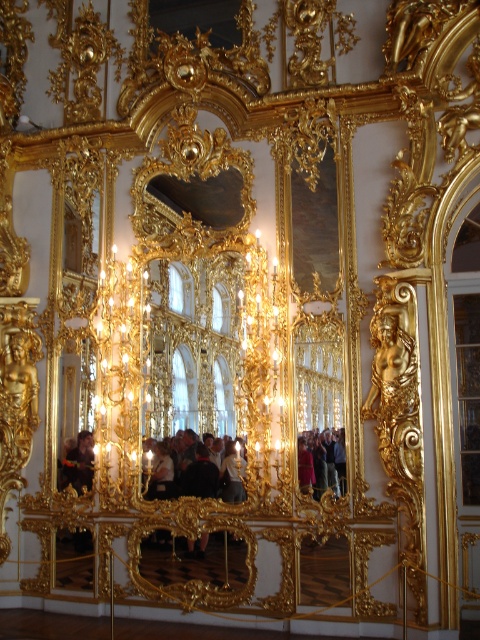
Between dark brown leather jacket at center and dark brown leather jacket at lower left, which one has more height?

With more height is dark brown leather jacket at lower left.

Can you confirm if dark brown leather jacket at center is thinner than dark brown leather jacket at lower left?

In fact, dark brown leather jacket at center might be wider than dark brown leather jacket at lower left.

Which is in front, point (237, 472) or point (88, 464)?

Point (237, 472) is more forward.

Locate an element on the screen. This screenshot has width=480, height=640. dark brown leather jacket at center is located at coordinates pos(206,476).

Can you confirm if shiny gold chandelier at center is positioned to the left of dark brown leather jacket at center?

Yes, shiny gold chandelier at center is to the left of dark brown leather jacket at center.

Who is positioned more to the left, shiny gold chandelier at center or dark brown leather jacket at center?

From the viewer's perspective, shiny gold chandelier at center appears more on the left side.

Between point (95, 339) and point (169, 493), which one is positioned behind?

Point (95, 339)

Locate an element on the screen. This screenshot has height=640, width=480. shiny gold chandelier at center is located at coordinates (120, 337).

Based on the photo, does dark brown leather jacket at center appear over matte black jacket at center?

No.

Consider the image. Is dark brown leather jacket at center to the left of matte black jacket at center from the viewer's perspective?

Indeed, dark brown leather jacket at center is positioned on the left side of matte black jacket at center.

Where is `dark brown leather jacket at center`? The image size is (480, 640). dark brown leather jacket at center is located at coordinates (206, 476).

This screenshot has width=480, height=640. Find the location of `dark brown leather jacket at center`. dark brown leather jacket at center is located at coordinates (206, 476).